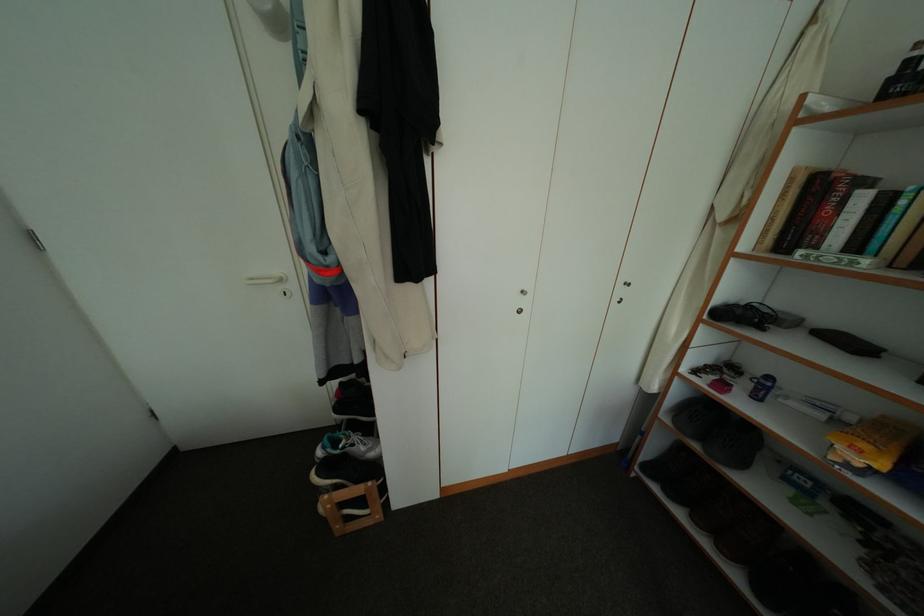
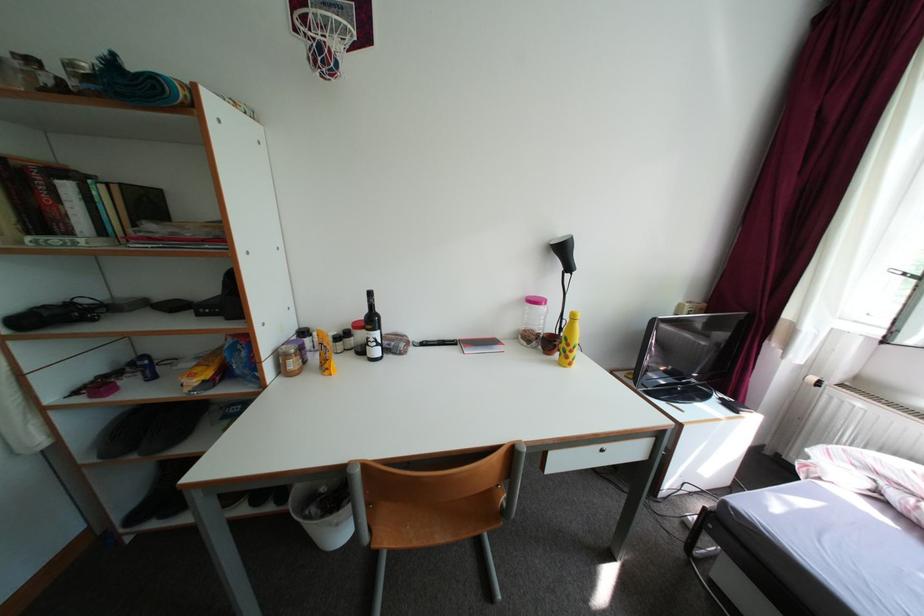
The first image is from the beginning of the video and the second image is from the end. How did the camera likely rotate when shooting the video?

The rotation direction of the camera is right-down.